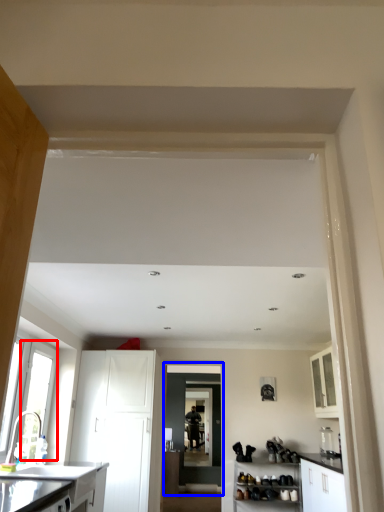
Question: Among these objects, which one is farthest to the camera, window (highlighted by a red box) or door (highlighted by a blue box)?

Choices:
 (A) window
 (B) door

Answer: (B)